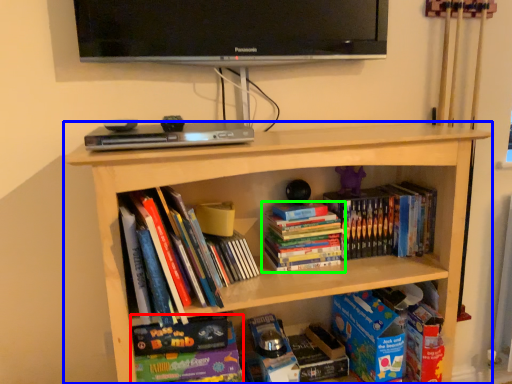
Question: Which is nearer to the book (highlighted by a red box)? bookcase (highlighted by a blue box) or book (highlighted by a green box).

Choices:
 (A) bookcase
 (B) book

Answer: (B)